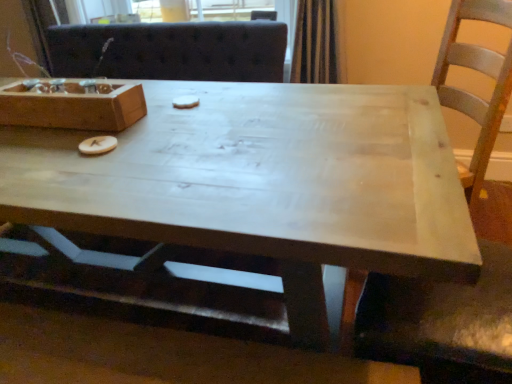
Question: Is the position of white matte cookie at center, the first food when ordered from right to left, more distant than that of wooden letter at center, which appears as the first food when viewed from the front?

Choices:
 (A) yes
 (B) no

Answer: (A)

Question: Can you confirm if white matte cookie at center, which is the 2th food in left-to-right order, is taller than wooden letter at center, arranged as the first food when ordered from the bottom?

Choices:
 (A) yes
 (B) no

Answer: (B)

Question: Is wooden letter at center, the 2th food positioned from the back, at the back of white matte cookie at center, which appears as the 2th food when viewed from the front?

Choices:
 (A) no
 (B) yes

Answer: (A)

Question: Are white matte cookie at center, which appears as the 2th food when viewed from the front, and wooden letter at center, which appears as the second food when viewed from the right, located far from each other?

Choices:
 (A) yes
 (B) no

Answer: (B)

Question: Is white matte cookie at center, which appears as the 2th food when viewed from the front, aimed at wooden letter at center, arranged as the first food when ordered from the bottom?

Choices:
 (A) yes
 (B) no

Answer: (A)

Question: In the image, is wooden box at upper left positioned in front of or behind light wood coffee table at center?

Choices:
 (A) behind
 (B) front

Answer: (A)

Question: From the image's perspective, relative to light wood coffee table at center, is wooden box at upper left above or below?

Choices:
 (A) above
 (B) below

Answer: (A)

Question: From a real-world perspective, is wooden box at upper left above or below light wood coffee table at center?

Choices:
 (A) below
 (B) above

Answer: (B)

Question: Looking at the image, does wooden box at upper left seem bigger or smaller compared to light wood coffee table at center?

Choices:
 (A) small
 (B) big

Answer: (A)

Question: Choose the correct answer: Is wooden box at upper left inside white matte cookie at center, which is the 2th food in left-to-right order, or outside it?

Choices:
 (A) inside
 (B) outside

Answer: (B)

Question: From the image's perspective, is wooden box at upper left located above or below white matte cookie at center, which appears as the 2th food when viewed from the front?

Choices:
 (A) below
 (B) above

Answer: (A)

Question: Is wooden box at upper left in front of or behind white matte cookie at center, which is the 2th food from bottom to top, in the image?

Choices:
 (A) front
 (B) behind

Answer: (A)

Question: In terms of width, does wooden box at upper left look wider or thinner when compared to white matte cookie at center, positioned as the first food in top-to-bottom order?

Choices:
 (A) wide
 (B) thin

Answer: (A)

Question: Is point (173, 102) closer or farther from the camera than point (109, 144)?

Choices:
 (A) farther
 (B) closer

Answer: (A)

Question: Considering the positions of white matte cookie at center, positioned as the first food in top-to-bottom order, and wooden letter at center, which appears as the second food when viewed from the right, in the image, is white matte cookie at center, positioned as the first food in top-to-bottom order, taller or shorter than wooden letter at center, which appears as the second food when viewed from the right,?

Choices:
 (A) short
 (B) tall

Answer: (A)